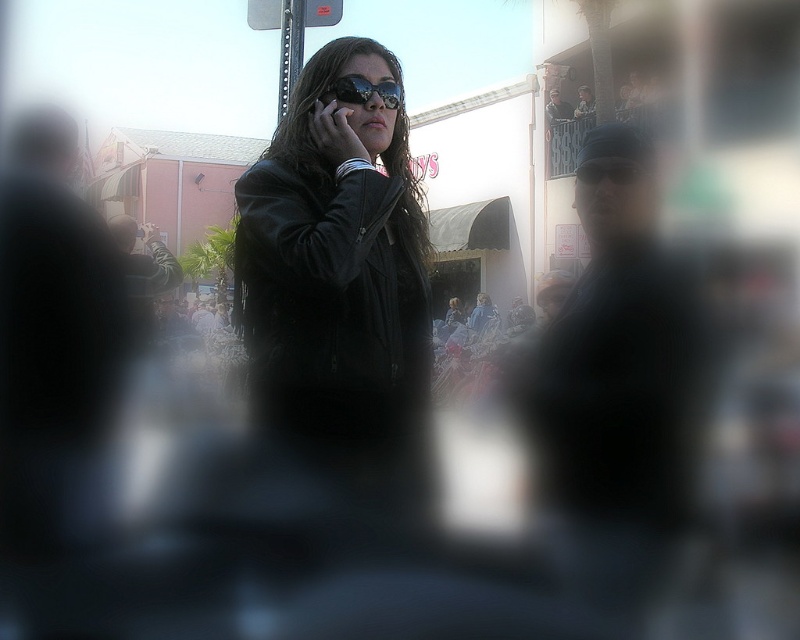
Looking at this image, measure the distance from black leather jacket at center to black matte smartphone at center.

They are 18.51 inches apart.

Can you confirm if black leather jacket at center is positioned to the left of black matte smartphone at center?

Incorrect, black leather jacket at center is not on the left side of black matte smartphone at center.

The width and height of the screenshot is (800, 640). Describe the element at coordinates (336, 266) in the screenshot. I see `black leather jacket at center` at that location.

Where is `black leather jacket at center`? This screenshot has width=800, height=640. black leather jacket at center is located at coordinates (336, 266).

Can you confirm if sunglasses at center is thinner than black matte smartphone at center?

Incorrect, sunglasses at center's width is not less than black matte smartphone at center's.

Does point (337, 81) come closer to viewer compared to point (328, 124)?

No, (337, 81) is behind (328, 124).

Is point (340, 76) closer to viewer compared to point (318, 100)?

Yes, it is.

You are a GUI agent. You are given a task and a screenshot of the screen. Output one action in this format:
    pyautogui.click(x=<x>, y=<y>)
    Task: Click on the sunglasses at center
    
    Given the screenshot: What is the action you would take?
    pyautogui.click(x=364, y=92)

Is black leather jacket at center to the left of sunglasses at center from the viewer's perspective?

Correct, you'll find black leather jacket at center to the left of sunglasses at center.

Can you confirm if black leather jacket at center is positioned above sunglasses at center?

Actually, black leather jacket at center is below sunglasses at center.

Locate an element on the screen. This screenshot has height=640, width=800. black leather jacket at center is located at coordinates (336, 266).

Identify the location of black leather jacket at center. (336, 266).